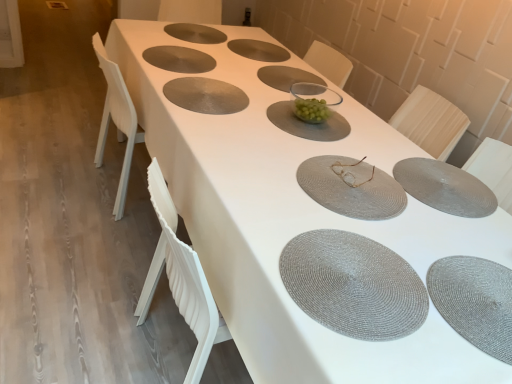
I want to click on vacant area that lies between gray woven placemat at center and gold metallic glasses at center, the 6th tableware when ordered from top to bottom, so click(x=262, y=125).